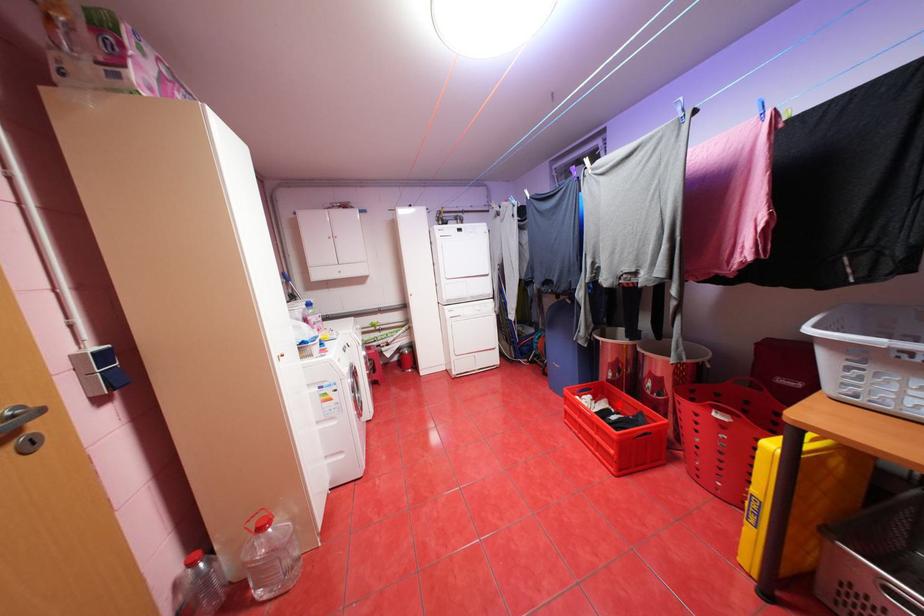
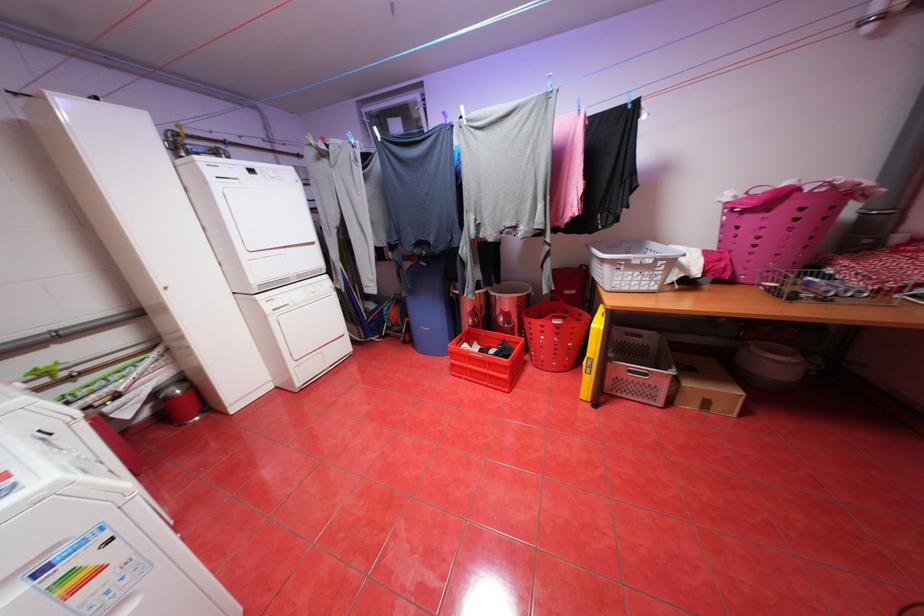
Question: A red point is marked in image1. In image2, is the corresponding 3D point closer to the camera or farther? Reply with the corresponding letter.

Choices:
 (A) The corresponding 3D point is closer.
 (B) The corresponding 3D point is farther.

Answer: (A)